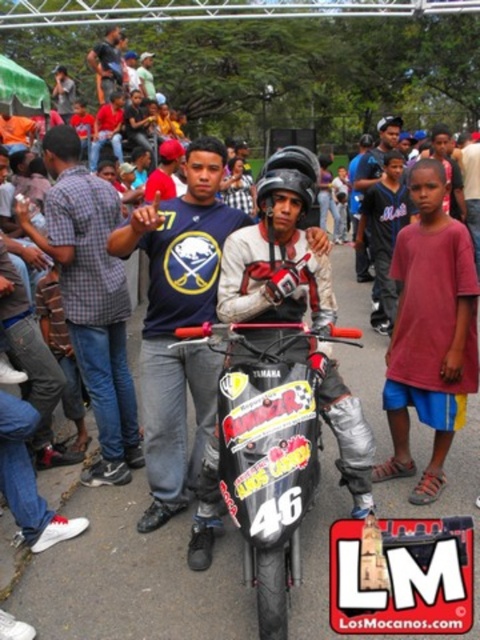
You are a GUI agent. You are given a task and a screenshot of the screen. Output one action in this format:
    pyautogui.click(x=<x>, y=<y>)
    Task: Click on the shiny metallic motorcycle at center
    
    Given the screenshot: What is the action you would take?
    [268, 449]

Between shiny metallic motorcycle at center and dark blue jersey at center, which one has less height?

Standing shorter between the two is shiny metallic motorcycle at center.

I want to click on shiny metallic motorcycle at center, so click(268, 449).

Is shiny metallic motorcycle at center to the right of matte black helmet at center from the viewer's perspective?

In fact, shiny metallic motorcycle at center is to the left of matte black helmet at center.

Does shiny metallic motorcycle at center have a larger size compared to matte black helmet at center?

No, shiny metallic motorcycle at center is not bigger than matte black helmet at center.

Is point (263, 531) farther from camera compared to point (475, 246)?

No, (263, 531) is closer to viewer.

This screenshot has width=480, height=640. Identify the location of shiny metallic motorcycle at center. (268, 449).

Based on the photo, is matte blue shirt at center bigger than dark blue jersey at center?

Actually, matte blue shirt at center might be smaller than dark blue jersey at center.

Between point (72, 301) and point (360, 189), which one is positioned in front?

Positioned in front is point (72, 301).

Find the location of a particular element. matte blue shirt at center is located at coordinates (91, 298).